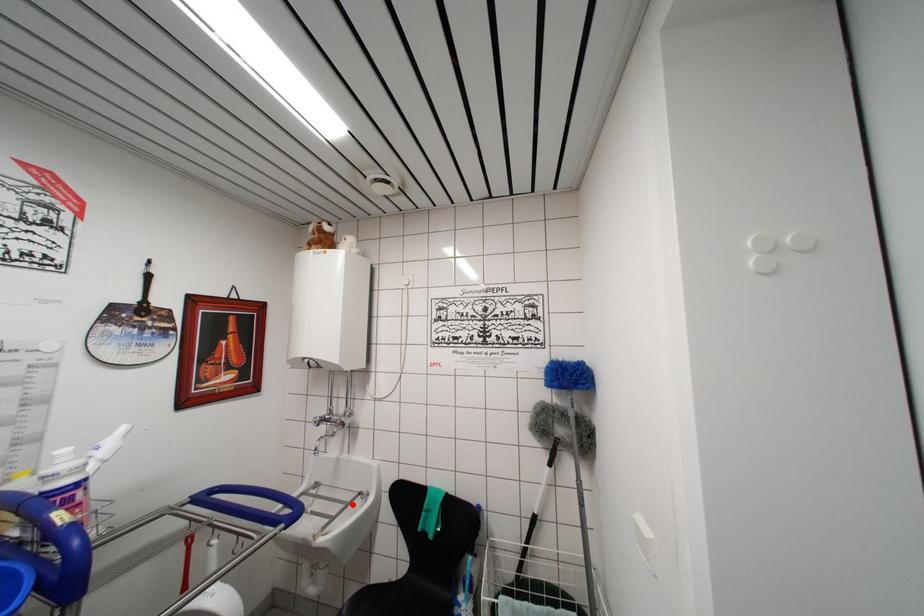
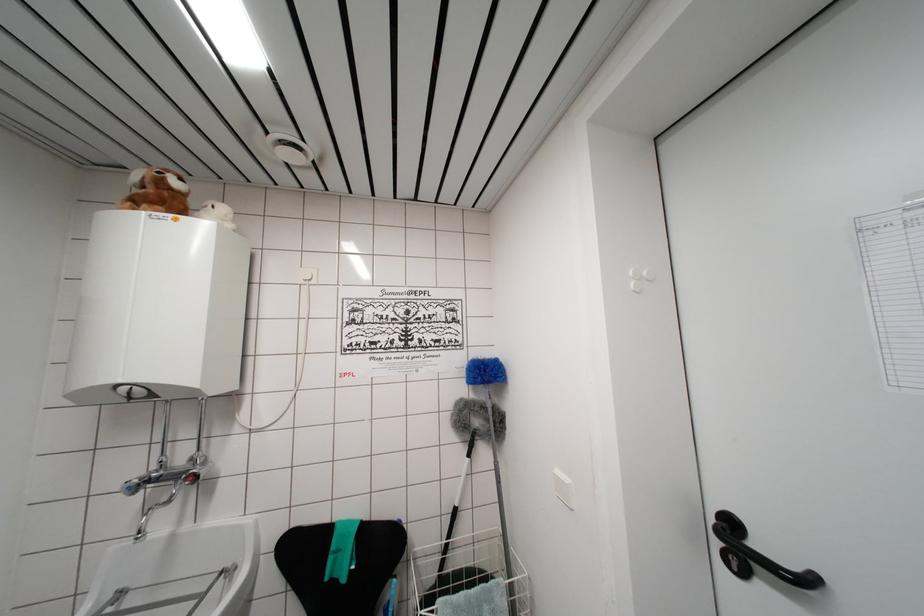
Question: I am providing you with two images of the same scene from different viewpoints. Image1 has a red point marked. In image2, the corresponding 3D location appears at what relative position? Reply with the corresponding letter.

Choices:
 (A) Closer
 (B) Farther

Answer: (A)